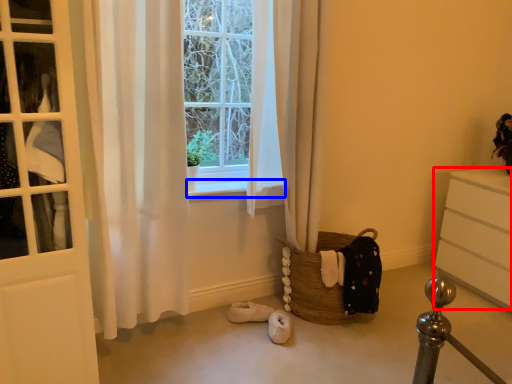
Question: Which point is further to the camera, chest of drawers (highlighted by a red box) or window sill (highlighted by a blue box)?

Choices:
 (A) chest of drawers
 (B) window sill

Answer: (A)